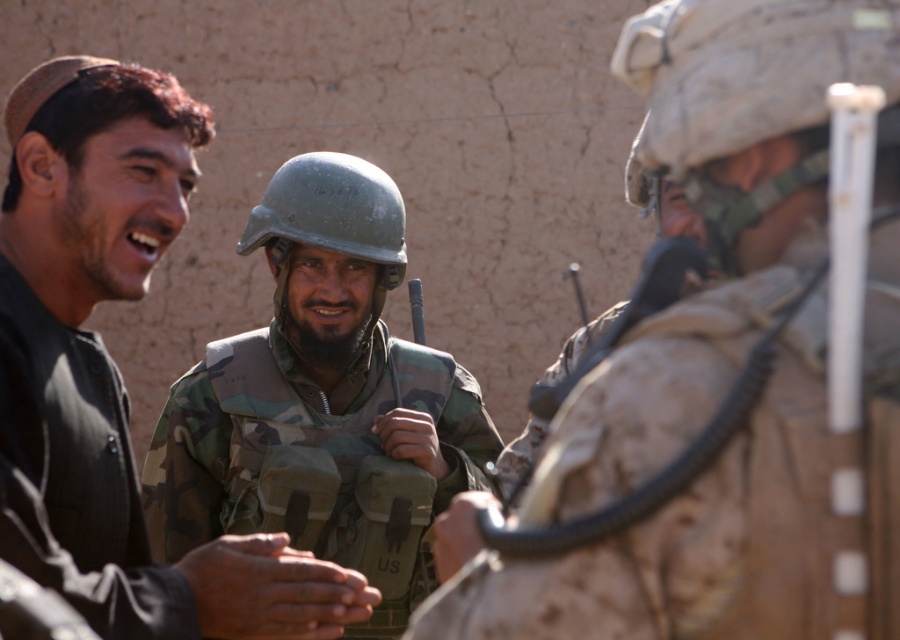
Consider the image. You are a soldier in the U.S. military unit depicted in the scene. You need to quickly identify which helmet is closer to you for immediate use. Which one should you choose between the camouflage fabric helmet at center and the green matte helmet at center?

You should choose the camouflage fabric helmet at center because it is closer to the viewer than the green matte helmet at center.

You are a drone operator observing the scene. There are two points marked in the image, point (46, 100) and point (304, 516). Which point is closer to your camera?

Point (46, 100) is closer to the camera than point (304, 516).

You are a photographer trying to capture a photo of the camouflage uniform at center and the camo fabric vest at center. If you want to ensure both are fully visible in the frame, which one should you adjust your camera focus to prioritize? Explain your reasoning based on their sizes.

The camouflage uniform at center is shorter than the camo fabric vest at center. To ensure both are fully visible, prioritize focusing on the camo fabric vest at center since it is taller and might require more space in the frame.